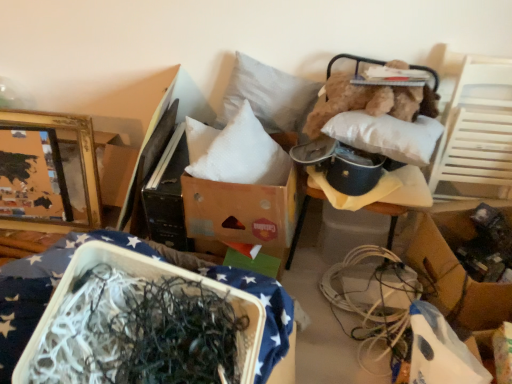
I want to click on white soft pillow at center, which ranks as the 2th pillow in left-to-right order, so click(x=268, y=96).

Measure the distance between point (x=276, y=136) and camera.

5.58 feet.

The height and width of the screenshot is (384, 512). Describe the element at coordinates (455, 272) in the screenshot. I see `brown cardboard box at lower right, which ranks as the second cardboard box in top-to-bottom order` at that location.

Where is `white styrofoam container at lower left, arranged as the second furniture when viewed from the back`? white styrofoam container at lower left, arranged as the second furniture when viewed from the back is located at coordinates (170, 263).

What is the approximate height of gold/gilded picture frame at upper left?

The height of gold/gilded picture frame at upper left is 23.21 inches.

Locate an element on the screen. The height and width of the screenshot is (384, 512). white soft pillow at center, the 1th pillow when ordered from right to left is located at coordinates (268, 96).

From the picture: Between white soft pillow at center, the 1th pillow when ordered from right to left, and brown cardboard box at center, which appears as the first cardboard box when viewed from the top, which one has larger size?

brown cardboard box at center, which appears as the first cardboard box when viewed from the top, is bigger.

Can you confirm if white soft pillow at center, which ranks as the 2th pillow in left-to-right order, is shorter than brown cardboard box at center, marked as the 2th cardboard box in a bottom-to-top arrangement?

In fact, white soft pillow at center, which ranks as the 2th pillow in left-to-right order, may be taller than brown cardboard box at center, marked as the 2th cardboard box in a bottom-to-top arrangement.

Relative to brown cardboard box at center, which is counted as the 2th cardboard box, starting from the right, is white soft pillow at center, which ranks as the 2th pillow in left-to-right order, in front or behind?

In the image, white soft pillow at center, which ranks as the 2th pillow in left-to-right order, appears behind brown cardboard box at center, which is counted as the 2th cardboard box, starting from the right.

Which is behind, point (481, 300) or point (213, 159)?

The point (213, 159) is behind.

Looking at this image, from the image's perspective, which object appears higher, brown cardboard box at lower right, positioned as the 1th cardboard box in right-to-left order, or white soft pillow at center, acting as the first pillow starting from the left?

white soft pillow at center, acting as the first pillow starting from the left, appears higher in the image.

Looking at this image, is white soft pillow at center, which appears as the second pillow when viewed from the right, at the back of brown cardboard box at lower right, arranged as the first cardboard box when ordered from the bottom?

No, brown cardboard box at lower right, arranged as the first cardboard box when ordered from the bottom,'s orientation is not away from white soft pillow at center, which appears as the second pillow when viewed from the right.

Is brown cardboard box at lower right, arranged as the first cardboard box when ordered from the bottom, at the left side of white soft pillow at center, acting as the first pillow starting from the left?

In fact, brown cardboard box at lower right, arranged as the first cardboard box when ordered from the bottom, is to the right of white soft pillow at center, acting as the first pillow starting from the left.

Is brown cardboard box at lower right, arranged as the first cardboard box when ordered from the bottom, taller or shorter than fuzzy brown teddy bear at upper right?

Considering their sizes, brown cardboard box at lower right, arranged as the first cardboard box when ordered from the bottom, has less height than fuzzy brown teddy bear at upper right.

Considering the sizes of brown cardboard box at lower right, which ranks as the second cardboard box in top-to-bottom order, and fuzzy brown teddy bear at upper right in the image, is brown cardboard box at lower right, which ranks as the second cardboard box in top-to-bottom order, wider or thinner than fuzzy brown teddy bear at upper right?

brown cardboard box at lower right, which ranks as the second cardboard box in top-to-bottom order, is thinner than fuzzy brown teddy bear at upper right.

Is brown cardboard box at lower right, acting as the 2th cardboard box starting from the left, not close to fuzzy brown teddy bear at upper right?

brown cardboard box at lower right, acting as the 2th cardboard box starting from the left, is near fuzzy brown teddy bear at upper right, not far away.

Is point (450, 228) closer to camera compared to point (409, 105)?

No, it is behind (409, 105).

Which is in front, fuzzy brown teddy bear at upper right or white styrofoam container at lower left, marked as the 1th furniture in a left-to-right arrangement?

Positioned in front is white styrofoam container at lower left, marked as the 1th furniture in a left-to-right arrangement.

Which object is wider, fuzzy brown teddy bear at upper right or white styrofoam container at lower left, marked as the 1th furniture in a left-to-right arrangement?

white styrofoam container at lower left, marked as the 1th furniture in a left-to-right arrangement.

Does point (391, 114) lie in front of point (9, 266)?

No, it is not.

Measure the distance between fuzzy brown teddy bear at upper right and white styrofoam container at lower left, positioned as the 1th furniture in front-to-back order.

The distance of fuzzy brown teddy bear at upper right from white styrofoam container at lower left, positioned as the 1th furniture in front-to-back order, is 85.84 centimeters.

Looking at the image, does white soft pillow at center, acting as the first pillow starting from the left, seem bigger or smaller compared to white plastic wire at lower right?

Clearly, white soft pillow at center, acting as the first pillow starting from the left, is smaller in size than white plastic wire at lower right.

Between point (246, 183) and point (393, 338), which one is positioned behind?

The point (393, 338) is more distant.

From the image's perspective, would you say white soft pillow at center, acting as the first pillow starting from the left, is shown under white plastic wire at lower right?

No, from the image's perspective, white soft pillow at center, acting as the first pillow starting from the left, is not beneath white plastic wire at lower right.

Locate an element on the screen. The width and height of the screenshot is (512, 384). wire below the white soft pillow at center, which appears as the second pillow when viewed from the right (from the image's perspective) is located at coordinates (373, 297).

Is white plastic wire at lower right next to brown cardboard box at center, which is counted as the 2th cardboard box, starting from the right?

No, white plastic wire at lower right is not beside brown cardboard box at center, which is counted as the 2th cardboard box, starting from the right.

Is white plastic wire at lower right aimed at brown cardboard box at center, acting as the first cardboard box starting from the left?

No, white plastic wire at lower right is not turned towards brown cardboard box at center, acting as the first cardboard box starting from the left.

Is point (389, 318) positioned in front of point (273, 224)?

That is False.

From the image's perspective, who appears lower, white plastic wire at lower right or brown cardboard box at center, marked as the 2th cardboard box in a bottom-to-top arrangement?

white plastic wire at lower right.

Is fuzzy brown teddy bear at upper right a part of brown cardboard box at center, marked as the 2th cardboard box in a bottom-to-top arrangement?

No, fuzzy brown teddy bear at upper right is not surrounded by brown cardboard box at center, marked as the 2th cardboard box in a bottom-to-top arrangement.

Which is farther, (x=277, y=232) or (x=339, y=110)?

Point (x=339, y=110)

Where is `teddy above the brown cardboard box at center, which is counted as the 2th cardboard box, starting from the right (from the image's perspective)`? The image size is (512, 384). teddy above the brown cardboard box at center, which is counted as the 2th cardboard box, starting from the right (from the image's perspective) is located at coordinates (369, 102).

From a real-world perspective, count 1st cardboard boxs downward from the white soft pillow at center, which ranks as the 2th pillow in left-to-right order, and point to it. Please provide its 2D coordinates.

[(241, 214)]

This screenshot has height=384, width=512. In order to click on the 2nd cardboard box to the right of the white soft pillow at center, acting as the first pillow starting from the left, starting your count from the anchor in this screenshot , I will do `click(455, 272)`.

Based on their spatial positions, is white plastic wire at lower right or brown cardboard box at lower right, acting as the 2th cardboard box starting from the left, further from white soft pillow at center, which appears as the second pillow when viewed from the right?

The object further to white soft pillow at center, which appears as the second pillow when viewed from the right, is brown cardboard box at lower right, acting as the 2th cardboard box starting from the left.

Which object lies nearer to the anchor point white soft pillow at center, which appears as the second pillow when viewed from the right, white fabric cushion at upper right, the second furniture viewed from the left, or white styrofoam container at lower left, arranged as the second furniture when viewed from the back?

Among the two, white fabric cushion at upper right, the second furniture viewed from the left, is located nearer to white soft pillow at center, which appears as the second pillow when viewed from the right.

From the image, which object appears to be farther from white soft pillow at center, acting as the first pillow starting from the left, fuzzy brown teddy bear at upper right or brown cardboard box at lower right, which ranks as the second cardboard box in top-to-bottom order?

brown cardboard box at lower right, which ranks as the second cardboard box in top-to-bottom order.

Which object lies further to the anchor point fuzzy brown teddy bear at upper right, white fabric cushion at upper right, placed as the second furniture when sorted from front to back, or brown cardboard box at center, marked as the 2th cardboard box in a bottom-to-top arrangement?

Among the two, brown cardboard box at center, marked as the 2th cardboard box in a bottom-to-top arrangement, is located further to fuzzy brown teddy bear at upper right.

Looking at the image, which one is located closer to white soft pillow at center, acting as the first pillow starting from the left, white plastic wire at lower right or white soft pillow at center, which ranks as the 2th pillow in left-to-right order?

white soft pillow at center, which ranks as the 2th pillow in left-to-right order.

Which object lies nearer to the anchor point white styrofoam container at lower left, marked as the 1th furniture in a left-to-right arrangement, white soft pillow at center, which ranks as the 2th pillow in left-to-right order, or white fabric cushion at upper right, placed as the second furniture when sorted from front to back?

Based on the image, white soft pillow at center, which ranks as the 2th pillow in left-to-right order, appears to be nearer to white styrofoam container at lower left, marked as the 1th furniture in a left-to-right arrangement.

When comparing their distances from white styrofoam container at lower left, positioned as the 1th furniture in front-to-back order, does white fabric cushion at upper right, the second furniture viewed from the left, or white plastic wire at lower right seem further?

white fabric cushion at upper right, the second furniture viewed from the left, is positioned further to the anchor white styrofoam container at lower left, positioned as the 1th furniture in front-to-back order.

From the image, which object appears to be farther from fuzzy brown teddy bear at upper right, white plastic wire at lower right or brown cardboard box at center, acting as the first cardboard box starting from the left?

white plastic wire at lower right is further to fuzzy brown teddy bear at upper right.

Where is `cardboard box situated between white soft pillow at center, acting as the first pillow starting from the left, and white fabric cushion at upper right, acting as the 1th furniture starting from the back, from left to right`? cardboard box situated between white soft pillow at center, acting as the first pillow starting from the left, and white fabric cushion at upper right, acting as the 1th furniture starting from the back, from left to right is located at coordinates pyautogui.click(x=241, y=214).

I want to click on cardboard box situated between gold/gilded picture frame at upper left and white plastic wire at lower right from left to right, so click(241, 214).

Where is `furniture between white plastic wire at lower right and brown cardboard box at lower right, which ranks as the second cardboard box in top-to-bottom order, in the horizontal direction`? This screenshot has width=512, height=384. furniture between white plastic wire at lower right and brown cardboard box at lower right, which ranks as the second cardboard box in top-to-bottom order, in the horizontal direction is located at coordinates (373, 96).

Where is `cardboard box between white styrofoam container at lower left, positioned as the 1th furniture in front-to-back order, and white soft pillow at center, acting as the first pillow starting from the left, from front to back`? The width and height of the screenshot is (512, 384). cardboard box between white styrofoam container at lower left, positioned as the 1th furniture in front-to-back order, and white soft pillow at center, acting as the first pillow starting from the left, from front to back is located at coordinates (241, 214).